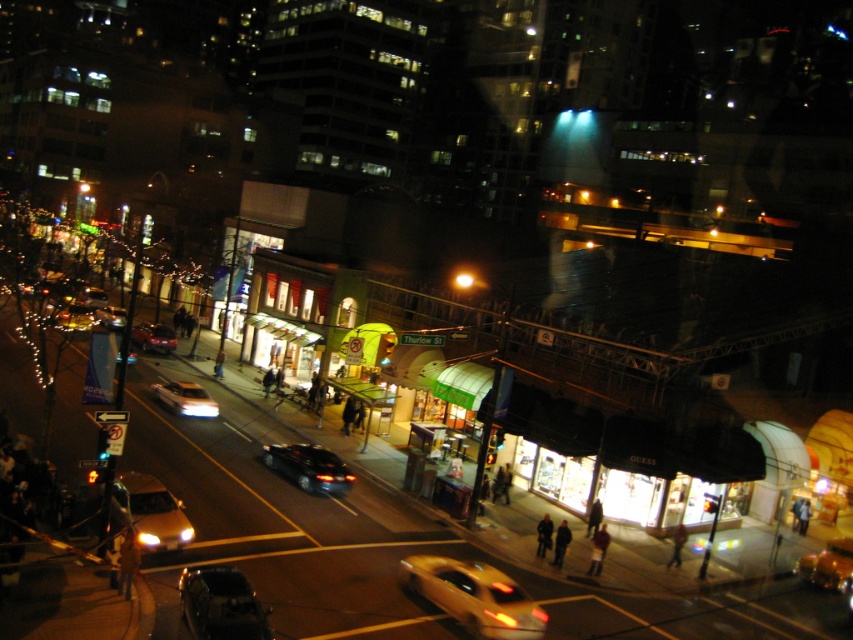
Who is shorter, yellow metallic taxi at lower right or light brown leather jacket at center?

Standing shorter between the two is yellow metallic taxi at lower right.

Does point (828, 582) come farther from viewer compared to point (218, 364)?

No, it is in front of (218, 364).

Where is `yellow metallic taxi at lower right`? This screenshot has width=853, height=640. yellow metallic taxi at lower right is located at coordinates (827, 564).

Who is positioned more to the right, shiny black car at lower left or light brown leather jacket at center?

Positioned to the right is shiny black car at lower left.

Between point (206, 616) and point (218, 355), which one is positioned in front?

Positioned in front is point (206, 616).

Between point (212, 608) and point (213, 369), which one is positioned in front?

Positioned in front is point (212, 608).

This screenshot has height=640, width=853. I want to click on shiny black car at lower left, so click(x=219, y=604).

Does matte gold car at lower left come behind dark brown leather jacket at lower left?

That is True.

In the scene shown: Is matte gold car at lower left above dark brown leather jacket at lower left?

Yes.

Locate an element on the screen. matte gold car at lower left is located at coordinates (149, 513).

I want to click on matte gold car at lower left, so click(149, 513).